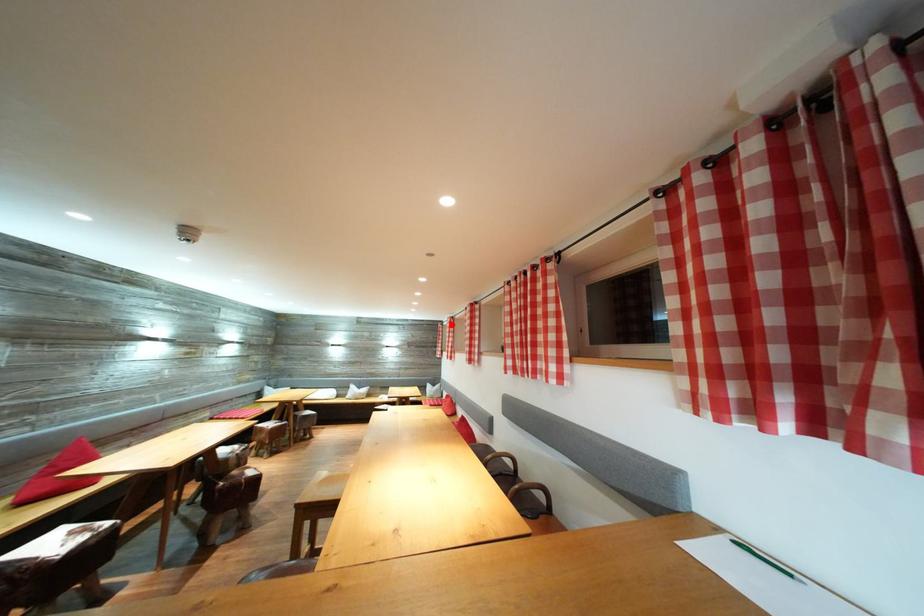
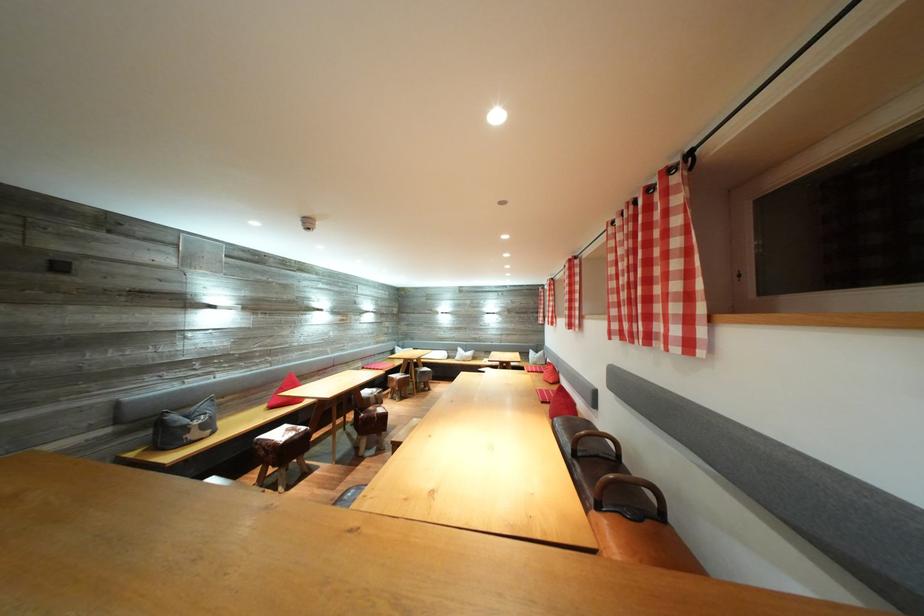
Find the pixel in the second image that matches the highlighted location in the first image.

(553, 288)